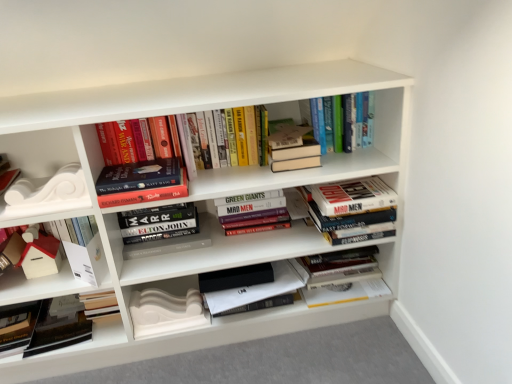
Question: Considering the relative positions of white matte paper at lower left, the 2th paperback book when ordered from left to right, and white matte decorative element at left, which ranks as the second shelf in bottom-to-top order, in the image provided, is white matte paper at lower left, the 2th paperback book when ordered from left to right, to the left of white matte decorative element at left, which ranks as the second shelf in bottom-to-top order, from the viewer's perspective?

Choices:
 (A) yes
 (B) no

Answer: (B)

Question: Is white matte paper at lower left, the 2th paperback book when ordered from left to right, closer to camera compared to white matte decorative element at left, positioned as the 1th shelf in top-to-bottom order?

Choices:
 (A) no
 (B) yes

Answer: (A)

Question: Is white matte paper at lower left, arranged as the second paperback book when viewed from the right, not within white matte decorative element at left, which ranks as the second shelf in bottom-to-top order?

Choices:
 (A) yes
 (B) no

Answer: (A)

Question: Can you confirm if white matte paper at lower left, the 2th paperback book when ordered from left to right, is smaller than white matte decorative element at left, positioned as the 1th shelf in top-to-bottom order?

Choices:
 (A) yes
 (B) no

Answer: (A)

Question: Is white matte paper at lower left, the 2th paperback book when ordered from left to right, at the right side of white matte decorative element at left, which ranks as the second shelf in bottom-to-top order?

Choices:
 (A) no
 (B) yes

Answer: (B)

Question: From a real-world perspective, is white matte paper at lower left, the 2th paperback book when ordered from left to right, located higher than white matte decorative element at left, positioned as the 1th shelf in top-to-bottom order?

Choices:
 (A) no
 (B) yes

Answer: (A)

Question: Is white matte decorative element at left, which appears as the second shelf when viewed from the right, shorter than black matte book at lower left, the second book from the left?

Choices:
 (A) yes
 (B) no

Answer: (B)

Question: Considering the relative positions of white matte decorative element at left, which ranks as the second shelf in bottom-to-top order, and black matte book at lower left, the 9th book viewed from the right, in the image provided, is white matte decorative element at left, which ranks as the second shelf in bottom-to-top order, to the right of black matte book at lower left, the 9th book viewed from the right, from the viewer's perspective?

Choices:
 (A) yes
 (B) no

Answer: (A)

Question: Can you confirm if white matte decorative element at left, the 1th shelf positioned from the left, is wider than black matte book at lower left, the second book from the left?

Choices:
 (A) yes
 (B) no

Answer: (B)

Question: Considering the relative sizes of white matte decorative element at left, which ranks as the second shelf in bottom-to-top order, and black matte book at lower left, the 9th book viewed from the right, in the image provided, is white matte decorative element at left, which ranks as the second shelf in bottom-to-top order, bigger than black matte book at lower left, the 9th book viewed from the right,?

Choices:
 (A) no
 (B) yes

Answer: (B)

Question: Is white matte decorative element at left, the 1th shelf positioned from the left, looking in the opposite direction of black matte book at lower left, the 9th book viewed from the right?

Choices:
 (A) no
 (B) yes

Answer: (A)

Question: Is white matte decorative element at left, the 1th shelf positioned from the left, smaller than black matte book at lower left, the second book from the left?

Choices:
 (A) no
 (B) yes

Answer: (A)

Question: Would you say white matte paper at lower left, the 2th paperback book when ordered from left to right, is part of white matte decorative molding at lower left, which is the first paperback book from right to left,'s contents?

Choices:
 (A) no
 (B) yes

Answer: (A)